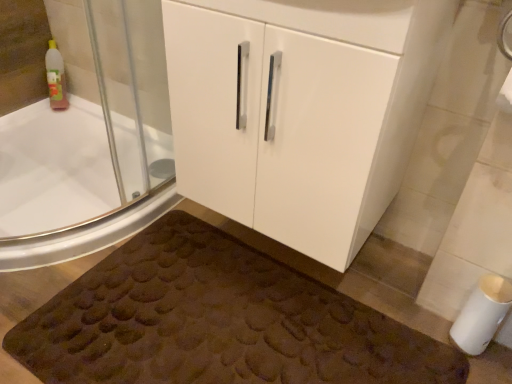
Question: Considering the positions of white matte toilet paper at lower right and white glossy bathtub at upper left in the image, is white matte toilet paper at lower right bigger or smaller than white glossy bathtub at upper left?

Choices:
 (A) small
 (B) big

Answer: (A)

Question: Is white matte toilet paper at lower right inside the boundaries of white glossy bathtub at upper left, or outside?

Choices:
 (A) outside
 (B) inside

Answer: (A)

Question: Estimate the real-world distances between objects in this image. Which object is farther from the brown textured bath mat at lower center?

Choices:
 (A) white glossy bathtub at upper left
 (B) white matte toilet paper at lower right
 (C) white glossy cabinet at center

Answer: (A)

Question: Which is nearer to the brown textured bath mat at lower center?

Choices:
 (A) white glossy cabinet at center
 (B) white glossy bathtub at upper left
 (C) white matte toilet paper at lower right

Answer: (A)